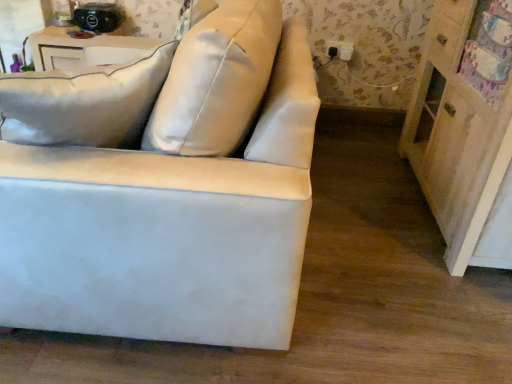
Question: Considering the relative sizes of white leather couch at center and wooden dresser at right in the image provided, is white leather couch at center wider than wooden dresser at right?

Choices:
 (A) yes
 (B) no

Answer: (A)

Question: Considering the relative sizes of white leather couch at center and wooden dresser at right in the image provided, is white leather couch at center taller than wooden dresser at right?

Choices:
 (A) yes
 (B) no

Answer: (B)

Question: From the image's perspective, is white leather couch at center under wooden dresser at right?

Choices:
 (A) no
 (B) yes

Answer: (B)

Question: From a real-world perspective, does white leather couch at center sit lower than wooden dresser at right?

Choices:
 (A) no
 (B) yes

Answer: (B)

Question: From a real-world perspective, is white leather couch at center on top of wooden dresser at right?

Choices:
 (A) no
 (B) yes

Answer: (A)

Question: Is white leather couch at center not inside wooden dresser at right?

Choices:
 (A) no
 (B) yes

Answer: (B)

Question: From the image's perspective, would you say wooden dresser at right is positioned over black plastic outlet at upper right?

Choices:
 (A) yes
 (B) no

Answer: (B)

Question: Could you tell me if wooden dresser at right is turned towards black plastic outlet at upper right?

Choices:
 (A) no
 (B) yes

Answer: (A)

Question: Is wooden dresser at right positioned far away from black plastic outlet at upper right?

Choices:
 (A) yes
 (B) no

Answer: (B)

Question: From the image's perspective, does wooden dresser at right appear lower than black plastic outlet at upper right?

Choices:
 (A) no
 (B) yes

Answer: (B)

Question: Does wooden dresser at right have a larger size compared to black plastic outlet at upper right?

Choices:
 (A) yes
 (B) no

Answer: (A)

Question: Considering the relative sizes of wooden dresser at right and black plastic outlet at upper right in the image provided, is wooden dresser at right shorter than black plastic outlet at upper right?

Choices:
 (A) yes
 (B) no

Answer: (B)

Question: Is white leather couch at center at the left side of black plastic outlet at upper right?

Choices:
 (A) no
 (B) yes

Answer: (B)